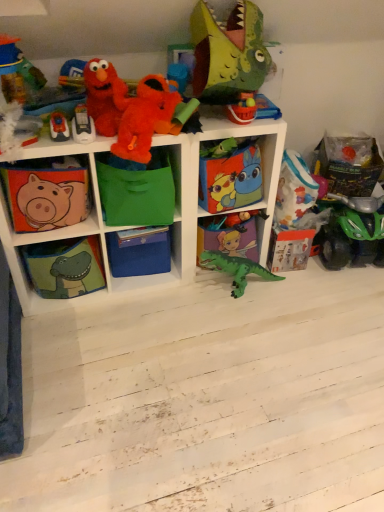
You are a GUI agent. You are given a task and a screenshot of the screen. Output one action in this format:
    pyautogui.click(x=<x>, y=<y>)
    Task: Click on the free location to the left of green plastic dinosaur at center, which ranks as the 1th toy in bottom-to-top order
    This screenshot has width=384, height=512.
    Given the screenshot: What is the action you would take?
    pyautogui.click(x=173, y=301)